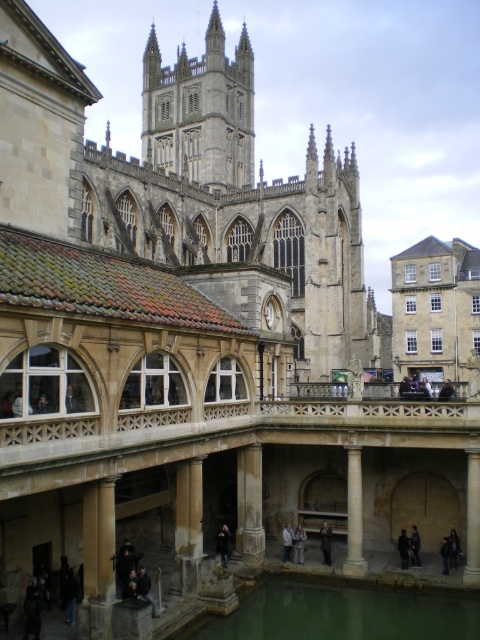
You are standing at the entrance of the Roman bath complex and want to reach the dark blue jacket at center without getting wet. The pool at the center is in your path. Can you walk around the stone column at center to avoid the water?

The stone column at center is 3.13 meters away from dark blue jacket at center. Since the column is between you and the jacket, you can walk around it to avoid the pool at the center.

You are standing in the historic scene described. You need to locate the dark blue jacket at lower center. Where exactly is it positioned in the image?

The dark blue jacket at lower center is positioned at point coordinates of 0.920 on the x axis and 0.302 on the y axis.

You are an architect designing a new public space and want to ensure that the stone column at center is visible from all angles around the dark blue jacket at center. Given their sizes, is this possible?

The stone column at center is wider than the dark blue jacket at center, so it will block the view from some angles around the jacket.